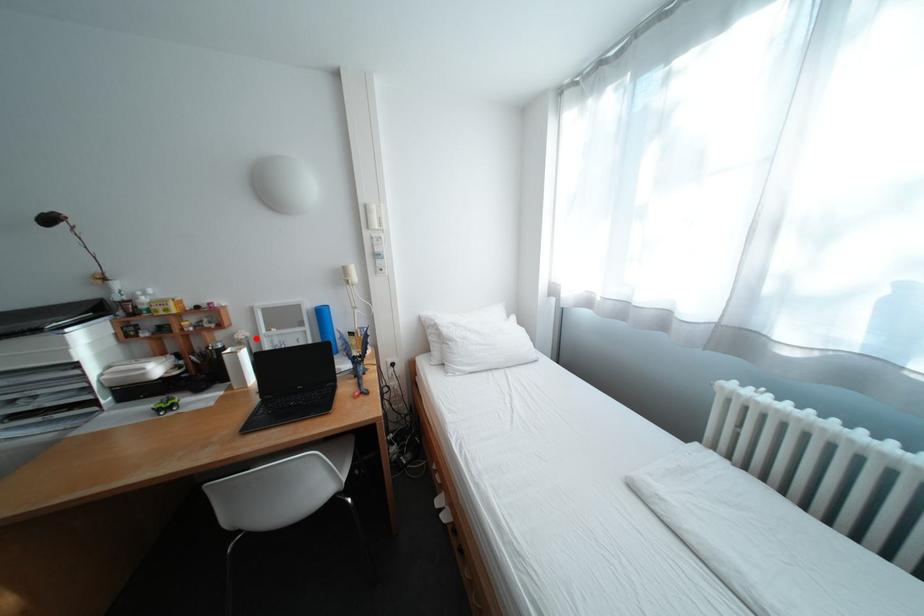
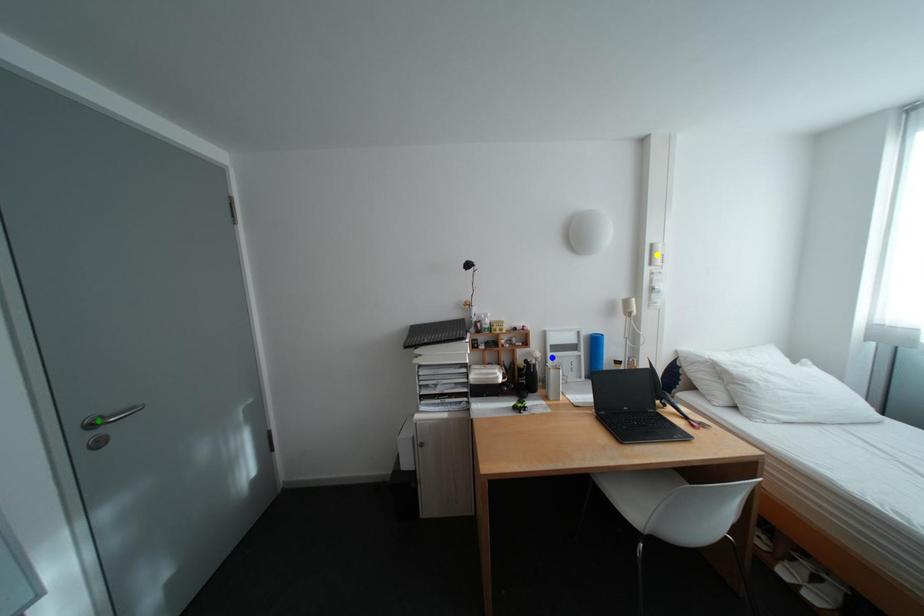
Question: I am providing you with two images of the same scene from different viewpoints. A red point is marked on the first image. You are given multiple points on the second image. Which spot in image 2 lines up with the point in image 1?

Choices:
 (A) green point
 (B) yellow point
 (C) blue point

Answer: (C)